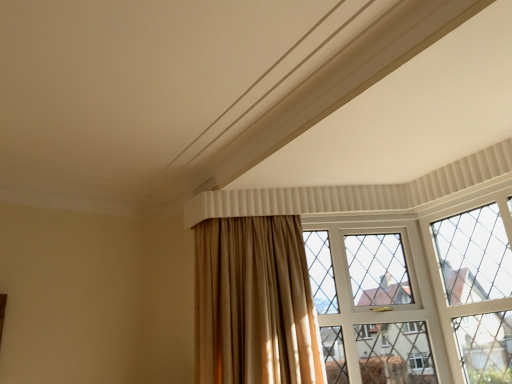
Where is `satin gold curtain at center`? The width and height of the screenshot is (512, 384). satin gold curtain at center is located at coordinates (254, 303).

Describe the element at coordinates (254, 303) in the screenshot. I see `satin gold curtain at center` at that location.

In order to face satin gold curtain at center, should I rotate leftwards or rightwards?

A 0.797 degree turn to the right will do.

Describe the element at coordinates (416, 291) in the screenshot. The width and height of the screenshot is (512, 384). I see `clear glass window at center` at that location.

Locate an element on the screen. The width and height of the screenshot is (512, 384). clear glass window at center is located at coordinates (416, 291).

You are a GUI agent. You are given a task and a screenshot of the screen. Output one action in this format:
    pyautogui.click(x=<x>, y=<y>)
    Task: Click on the satin gold curtain at center
    The width and height of the screenshot is (512, 384).
    Given the screenshot: What is the action you would take?
    pyautogui.click(x=254, y=303)

Considering the relative positions of clear glass window at center and satin gold curtain at center in the image provided, is clear glass window at center to the right of satin gold curtain at center from the viewer's perspective?

Indeed, clear glass window at center is positioned on the right side of satin gold curtain at center.

Between clear glass window at center and satin gold curtain at center, which one is positioned behind?

clear glass window at center.

Does point (353, 288) come closer to viewer compared to point (300, 239)?

That is False.

From the image's perspective, between clear glass window at center and satin gold curtain at center, who is located below?

clear glass window at center is shown below in the image.

From a real-world perspective, between clear glass window at center and satin gold curtain at center, who is vertically higher?

satin gold curtain at center is physically above.

Which object is wider, clear glass window at center or satin gold curtain at center?

Wider between the two is satin gold curtain at center.

Consider the image. Considering the sizes of objects clear glass window at center and satin gold curtain at center in the image provided, who is shorter, clear glass window at center or satin gold curtain at center?

With less height is satin gold curtain at center.

Which of these two, clear glass window at center or satin gold curtain at center, is bigger?

satin gold curtain at center.

Is clear glass window at center not inside satin gold curtain at center?

clear glass window at center is positioned outside satin gold curtain at center.

Is clear glass window at center not close to satin gold curtain at center?

clear glass window at center is actually quite close to satin gold curtain at center.

Is clear glass window at center oriented towards satin gold curtain at center?

No, clear glass window at center is not facing towards satin gold curtain at center.

In the scene shown: How many degrees apart are the facing directions of clear glass window at center and satin gold curtain at center?

The angular difference between clear glass window at center and satin gold curtain at center is 1.23 degrees.

At what (x,y) coordinates should I click in order to perform the action: click on curtain on the left of clear glass window at center. Please return your answer as a coordinate pair (x, y). Looking at the image, I should click on (254, 303).

In the scene shown: Considering the relative positions of satin gold curtain at center and clear glass window at center in the image provided, is satin gold curtain at center to the right of clear glass window at center from the viewer's perspective?

No.

Is satin gold curtain at center closer to the viewer compared to clear glass window at center?

Yes, the depth of satin gold curtain at center is less than that of clear glass window at center.

Is point (203, 257) farther from camera compared to point (426, 314)?

That is False.

From the image's perspective, which one is positioned higher, satin gold curtain at center or clear glass window at center?

satin gold curtain at center is shown above in the image.

From a real-world perspective, which is physically below, satin gold curtain at center or clear glass window at center?

clear glass window at center, from a real-world perspective.

Which object is thinner, satin gold curtain at center or clear glass window at center?

With smaller width is clear glass window at center.

Who is shorter, satin gold curtain at center or clear glass window at center?

satin gold curtain at center.

Can you confirm if satin gold curtain at center is smaller than clear glass window at center?

Incorrect, satin gold curtain at center is not smaller in size than clear glass window at center.

Which is correct: satin gold curtain at center is inside clear glass window at center, or outside of it?

satin gold curtain at center is not inside clear glass window at center, it's outside.

Is satin gold curtain at center far away from clear glass window at center?

No, satin gold curtain at center is in close proximity to clear glass window at center.

In the scene shown: Could you tell me if satin gold curtain at center is facing clear glass window at center?

No, satin gold curtain at center is not turned towards clear glass window at center.

What's the angular difference between satin gold curtain at center and clear glass window at center's facing directions?

The angle between the facing direction of satin gold curtain at center and the facing direction of clear glass window at center is 1.23 degrees.

You are a GUI agent. You are given a task and a screenshot of the screen. Output one action in this format:
    pyautogui.click(x=<x>, y=<y>)
    Task: Click on the curtain lying in front of the clear glass window at center
    This screenshot has width=512, height=384.
    Given the screenshot: What is the action you would take?
    tap(254, 303)

This screenshot has height=384, width=512. I want to click on curtain that appears above the clear glass window at center (from the image's perspective), so click(x=254, y=303).

The width and height of the screenshot is (512, 384). Find the location of `curtain located in front of the clear glass window at center`. curtain located in front of the clear glass window at center is located at coordinates (254, 303).